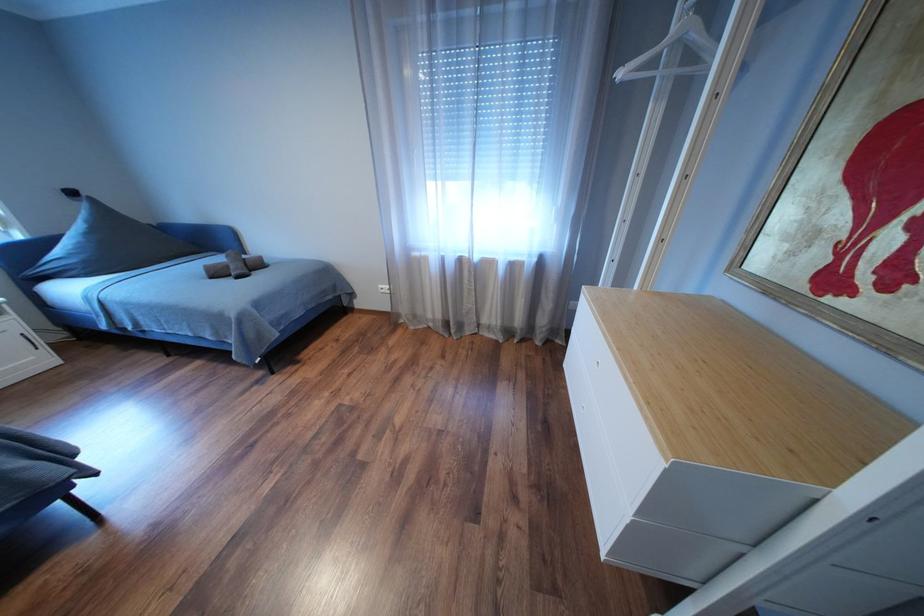
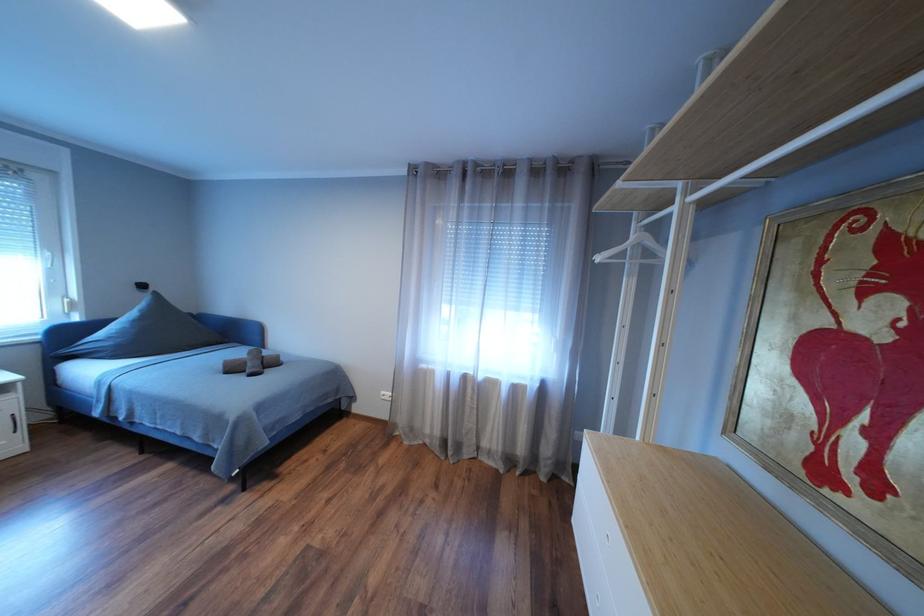
Question: What movement of the cameraman would produce the second image?

Choices:
 (A) Left
 (B) Right
 (C) Forward
 (D) Backward

Answer: (D)